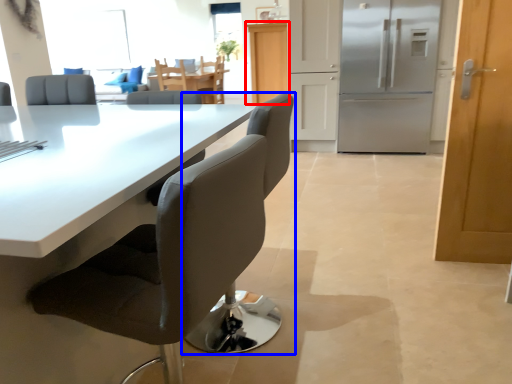
Question: Among these objects, which one is nearest to the camera, cabinetry (highlighted by a red box) or chair (highlighted by a blue box)?

Choices:
 (A) cabinetry
 (B) chair

Answer: (B)